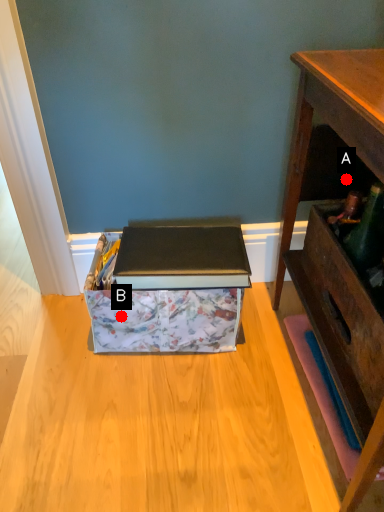
Question: Two points are circled on the image, labeled by A and B beside each circle. Among these points, which one is nearest to the camera?

Choices:
 (A) A is closer
 (B) B is closer

Answer: (A)